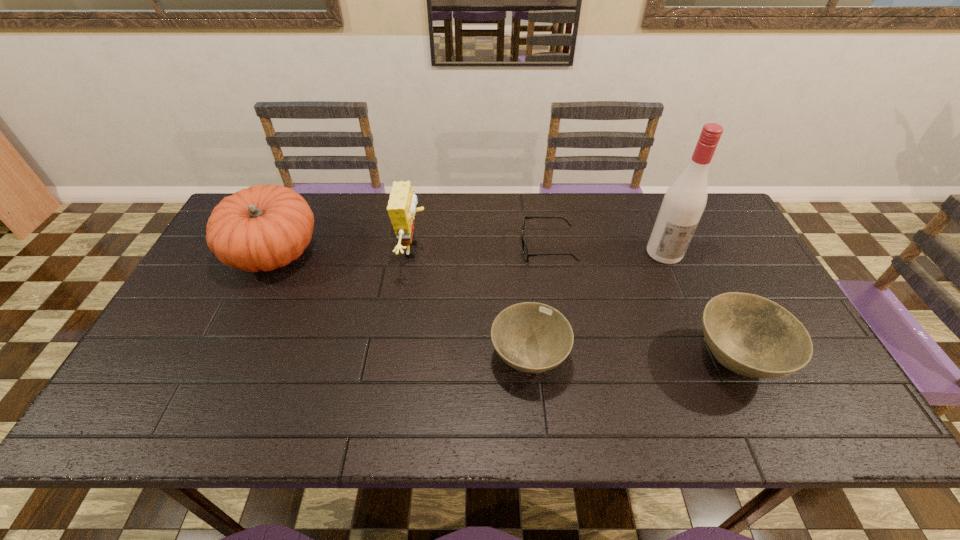
Where is `object that is positioned at the right edge`? The image size is (960, 540). object that is positioned at the right edge is located at coordinates (750, 335).

Find the location of a particular element. This screenshot has height=540, width=960. object at the far left corner is located at coordinates (264, 227).

At what (x,y) coordinates should I click in order to perform the action: click on object that is at the near right corner. Please return your answer as a coordinate pair (x, y). This screenshot has width=960, height=540. Looking at the image, I should click on (750, 335).

You are a GUI agent. You are given a task and a screenshot of the screen. Output one action in this format:
    pyautogui.click(x=<x>, y=<y>)
    Task: Click on the free region at the far edge of the desktop
    
    Given the screenshot: What is the action you would take?
    pyautogui.click(x=563, y=202)

You are a GUI agent. You are given a task and a screenshot of the screen. Output one action in this format:
    pyautogui.click(x=<x>, y=<y>)
    Task: Click on the vacant space at the near edge of the desktop
    
    Given the screenshot: What is the action you would take?
    pyautogui.click(x=355, y=373)

Identify the location of blank space at the left edge of the desktop. The height and width of the screenshot is (540, 960). tap(233, 293).

The width and height of the screenshot is (960, 540). In order to click on free space at the near right corner of the desktop in this screenshot , I will do `click(781, 382)`.

This screenshot has width=960, height=540. Identify the location of free space between the pumpkin and the second object from left to right. (344, 251).

Where is `free space that is in between the leftmost object and the tallest object`? This screenshot has height=540, width=960. free space that is in between the leftmost object and the tallest object is located at coordinates (469, 253).

Locate an element on the screen. The width and height of the screenshot is (960, 540). empty location between the sponge and the leftmost object is located at coordinates (344, 251).